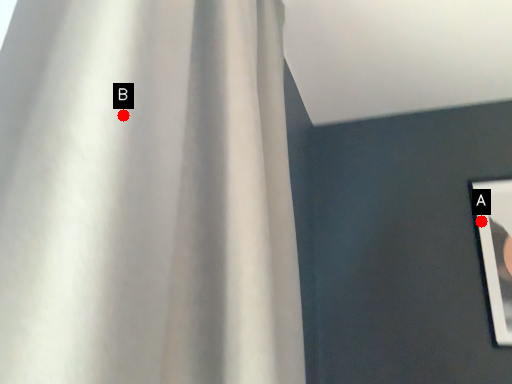
Question: Two points are circled on the image, labeled by A and B beside each circle. Which point is closer to the camera?

Choices:
 (A) A is closer
 (B) B is closer

Answer: (B)